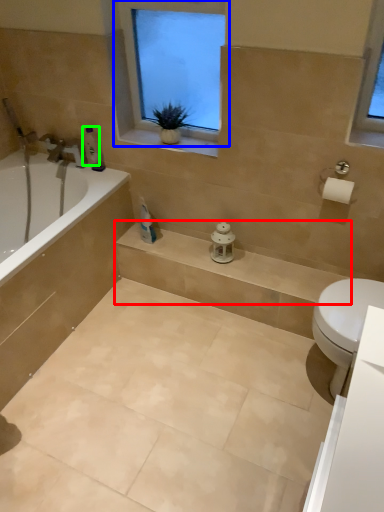
Question: Which object is the closest to the balustrade (highlighted by a red box)? Choose among these: window (highlighted by a blue box) or toiletry (highlighted by a green box).

Choices:
 (A) window
 (B) toiletry

Answer: (A)